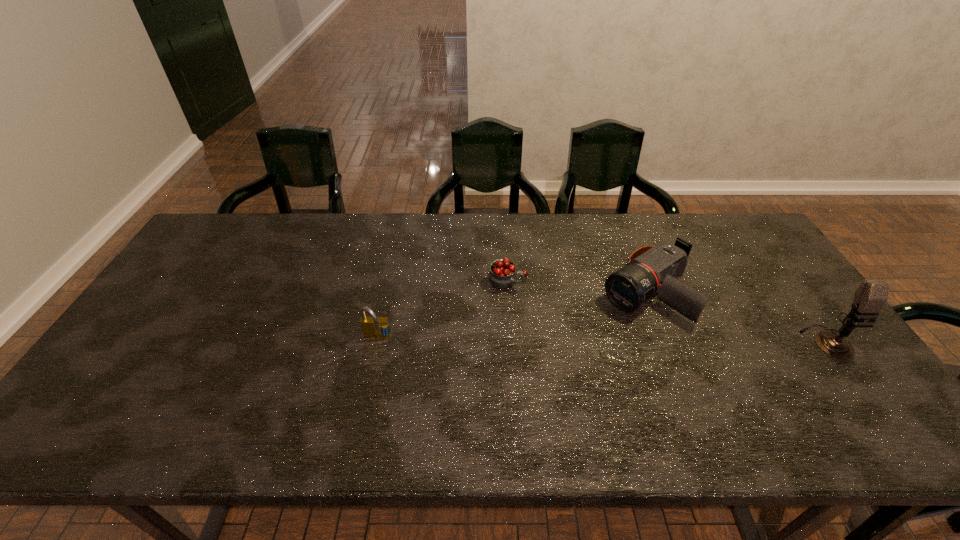
This screenshot has width=960, height=540. Find the location of `vacant point located between the tallest object and the camcorder`. vacant point located between the tallest object and the camcorder is located at coordinates (737, 316).

In order to click on empty space that is in between the microphone and the third object from right to left in this screenshot , I will do `click(667, 310)`.

Identify the location of free space between the tallest object and the camcorder. (737, 316).

Identify the location of free space between the third object from left to right and the third object from right to left. The image size is (960, 540). (578, 286).

The image size is (960, 540). In order to click on blank region between the pot filled with cherries and the camcorder in this screenshot , I will do point(578,286).

The image size is (960, 540). In order to click on empty space between the padlock and the rightmost object in this screenshot , I will do `click(602, 340)`.

The image size is (960, 540). Find the location of `free space between the tallest object and the second object from left to right`. free space between the tallest object and the second object from left to right is located at coordinates (667, 310).

Locate an element on the screen. This screenshot has width=960, height=540. vacant space that is in between the leftmost object and the pot filled with cherries is located at coordinates (443, 308).

Locate an element on the screen. Image resolution: width=960 pixels, height=540 pixels. free space between the third object from right to left and the camcorder is located at coordinates coord(578,286).

Identify which object is located as the third nearest to the leftmost object. Please provide its 2D coordinates. Your answer should be formatted as a tuple, i.e. [(x, y)], where the tuple contains the x and y coordinates of a point satisfying the conditions above.

[(872, 294)]